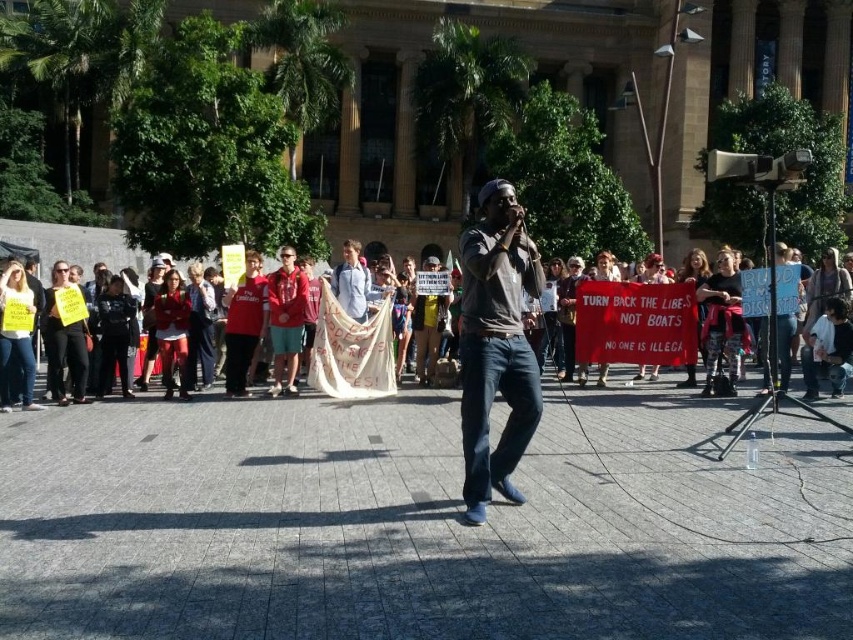
You are a photographer at the event and want to capture a clear photo of the matte gray shirt at center without the white cotton banner at center blocking it. What should you do?

Move the camera position to the side so the matte gray shirt at center is no longer directly in front of the white cotton banner at center.

You are standing in the plaza and want to take a photo of both the point at coordinates (512,337) and the point at (115,266). Which point should you focus on first to ensure both are in the same frame?

You should focus on point (512,337) first because it is closer to you than point (115,266), allowing both points to be captured in the same frame.

You are a photographer at the protest, and you want to capture a photo of both the matte gray shirt at center and the white cotton banner at center. Based on their positions, which object should you focus on first to ensure both are in frame?

The matte gray shirt at center is to the right of the white cotton banner at center, so you should focus on the white cotton banner at center first to ensure both are in frame.